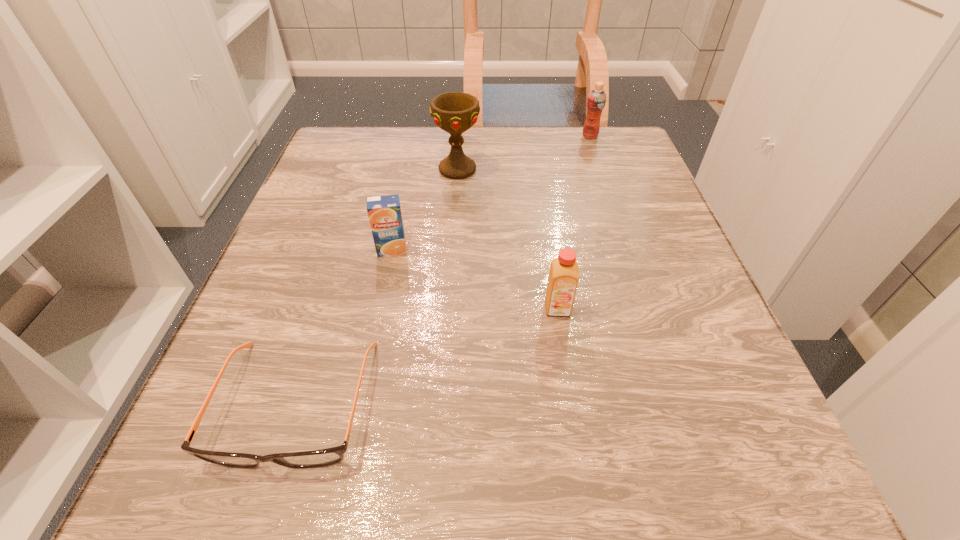
What are the coordinates of `vacant space situated 0.270m on the front of the second farthest object` in the screenshot? It's located at (450, 278).

Identify the location of vacant space located on the left of the farthest object. (441, 136).

You are a GUI agent. You are given a task and a screenshot of the screen. Output one action in this format:
    pyautogui.click(x=<x>, y=<y>)
    Task: Click on the vacant space situated 0.220m on the front and back of the fourth farthest object
    The width and height of the screenshot is (960, 540).
    Given the screenshot: What is the action you would take?
    pyautogui.click(x=584, y=470)

The width and height of the screenshot is (960, 540). In order to click on free location located 0.290m on the front of the third farthest object in this screenshot , I will do `click(357, 419)`.

You are a GUI agent. You are given a task and a screenshot of the screen. Output one action in this format:
    pyautogui.click(x=<x>, y=<y>)
    Task: Click on the chalice at the far edge
    The height and width of the screenshot is (540, 960).
    Given the screenshot: What is the action you would take?
    pyautogui.click(x=454, y=112)

Identify the location of orange juice that is positioned at the far edge. Image resolution: width=960 pixels, height=540 pixels. (596, 100).

Locate an element on the screen. This screenshot has height=540, width=960. object that is at the near edge is located at coordinates (317, 458).

Identify the location of object that is at the left edge. (317, 458).

The height and width of the screenshot is (540, 960). I want to click on object that is at the right edge, so click(596, 100).

The height and width of the screenshot is (540, 960). Identify the location of object that is positioned at the near left corner. (317, 458).